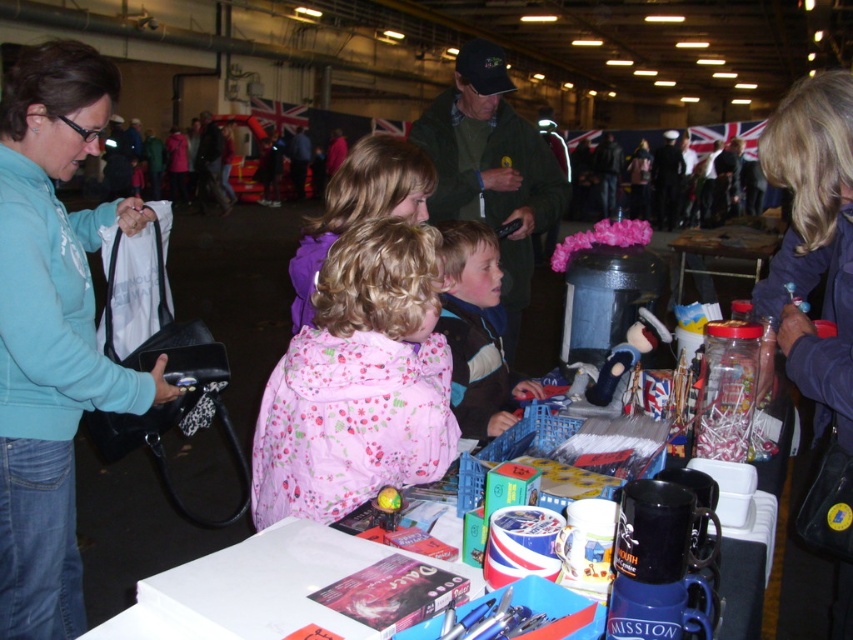
You are at the fair and want to place a new item on the wooden table at center. Where should you place it to ensure it doesn not cover the pink floral coat at center?

The pink floral coat at center is to the left of the wooden table at center, so placing the new item on the right side of the wooden table at center would avoid covering it.

You are organizing a charity event and need to place a 10 feet long banner between the green textured jacket at upper center and the wooden table at center. Is there enough space to hang the banner without overlapping either object?

The distance between the green textured jacket at upper center and the wooden table at center is 13.65 feet, which is greater than the 10 feet length of the banner. Therefore, there is enough space to hang the banner between them without overlapping either object.

You are standing in the middle of the hall and see two points marked in the scene. Which point, point (x=265, y=481) or point (x=700, y=257), is closer to you?

Point (x=265, y=481) is closer to the viewer than point (x=700, y=257).